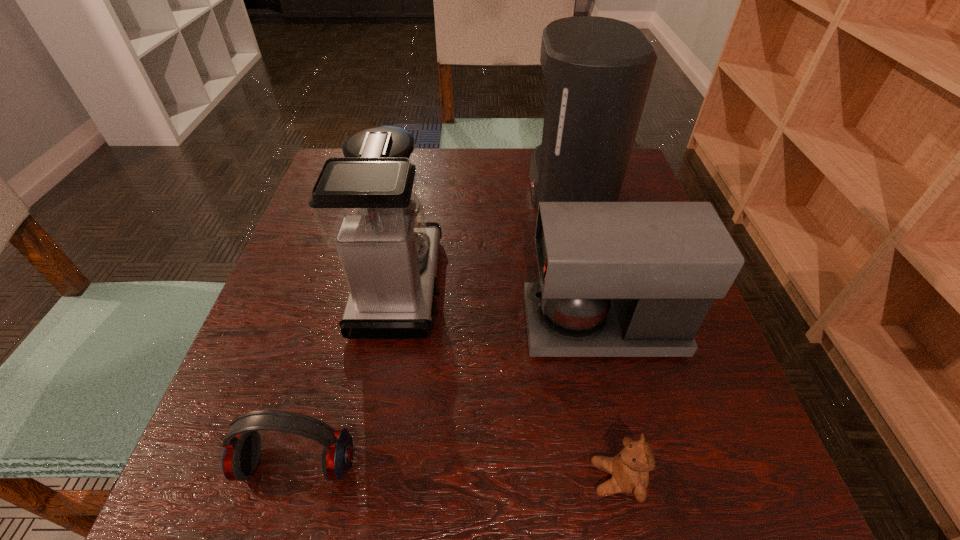
The width and height of the screenshot is (960, 540). Find the location of `vacant region located on the carafe side of the shortest coffee maker`. vacant region located on the carafe side of the shortest coffee maker is located at coordinates (386, 326).

At what (x,y) coordinates should I click in order to perform the action: click on free location located on the carafe side of the shortest coffee maker. Please return your answer as a coordinate pair (x, y). The width and height of the screenshot is (960, 540). Looking at the image, I should click on (381, 326).

The width and height of the screenshot is (960, 540). What are the coordinates of `free spot located 0.280m on the carafe side of the shortest coffee maker` in the screenshot? It's located at (375, 326).

Where is `vacant space located on the face of the shortest object`? vacant space located on the face of the shortest object is located at coordinates (390, 478).

In order to click on vacant space located 0.400m on the face of the shortest object in this screenshot , I will do `click(313, 478)`.

At what (x,y) coordinates should I click in order to perform the action: click on vacant point located on the face of the shortest object. Please return your answer as a coordinate pair (x, y). The image size is (960, 540). Looking at the image, I should click on (509, 478).

Locate an element on the screen. object that is at the far edge is located at coordinates (598, 70).

Locate an element on the screen. earphone positioned at the near edge is located at coordinates (242, 446).

In order to click on teddy bear positioned at the near edge in this screenshot , I will do `click(630, 468)`.

Where is `coffee maker at the left edge`? coffee maker at the left edge is located at coordinates (366, 205).